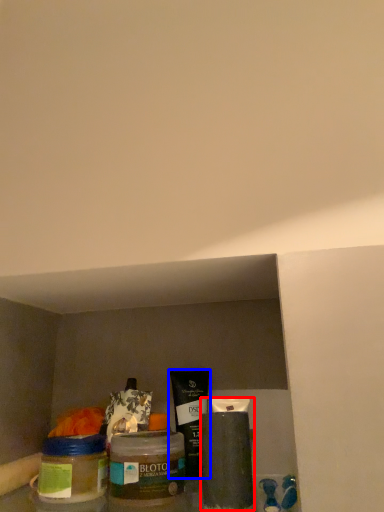
Question: Which point is further to the camera, cleaning product (highlighted by a red box) or product (highlighted by a blue box)?

Choices:
 (A) cleaning product
 (B) product

Answer: (B)